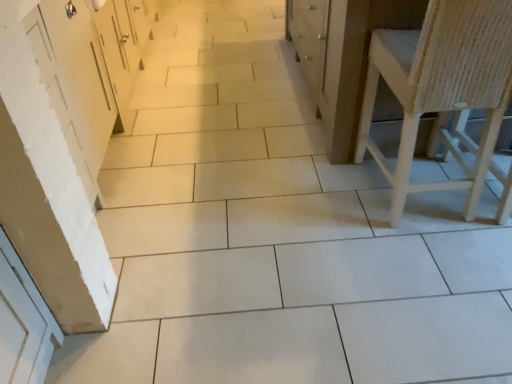
Image resolution: width=512 pixels, height=384 pixels. What are the coordinates of `woven wood chair at right` in the screenshot? It's located at (442, 88).

Measure the distance between point (415, 39) and camera.

Point (415, 39) and camera are 5.44 feet apart from each other.

Describe the element at coordinates (442, 88) in the screenshot. Image resolution: width=512 pixels, height=384 pixels. I see `woven wood chair at right` at that location.

Locate an element on the screen. woven wood chair at right is located at coordinates tap(442, 88).